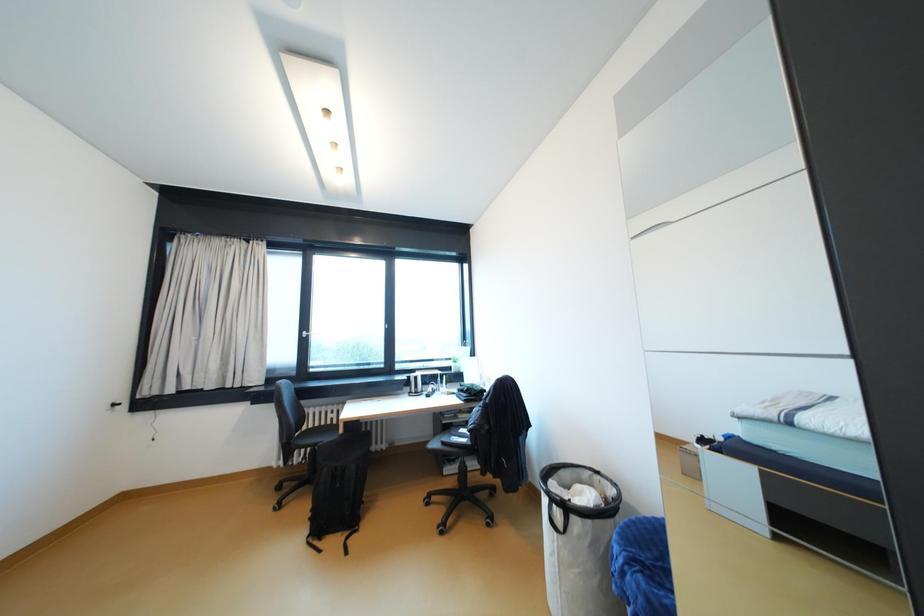
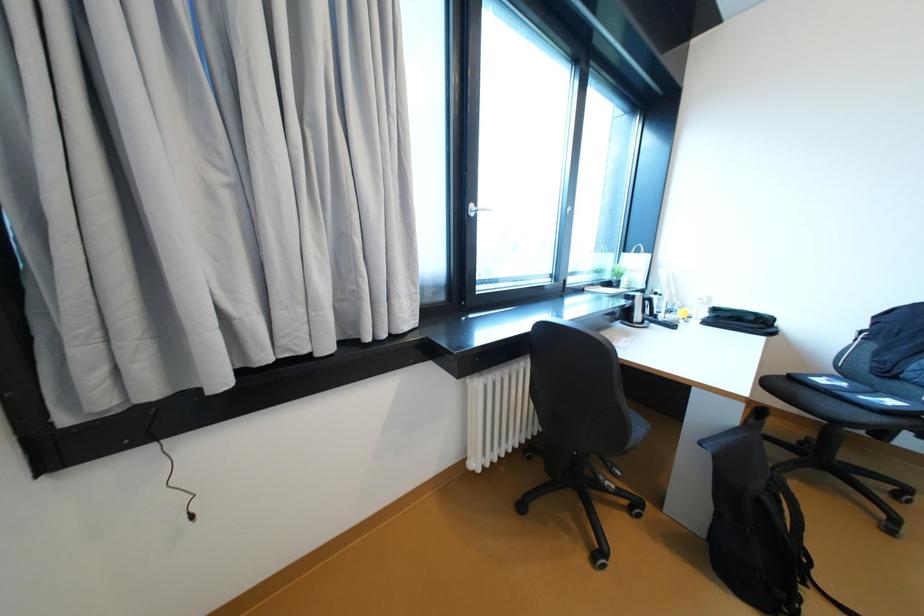
Which direction would the cameraman need to move to produce the second image?

The cameraman walked toward left, forward.